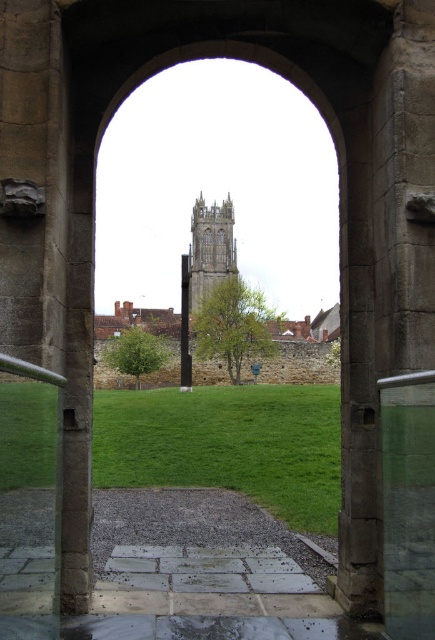
Question: Does green grass at center appear on the left side of stone tower at center?

Choices:
 (A) yes
 (B) no

Answer: (A)

Question: Which point is farther from the camera taking this photo?

Choices:
 (A) (210, 262)
 (B) (110, 374)
 (C) (140, 410)

Answer: (A)

Question: Does green grass at center appear on the right side of stone gothic tower at center?

Choices:
 (A) yes
 (B) no

Answer: (A)

Question: Does stone tower at center have a greater width compared to black stone pillar at center?

Choices:
 (A) no
 (B) yes

Answer: (B)

Question: Which object is farther from the camera taking this photo?

Choices:
 (A) stone tower at center
 (B) black stone pillar at center
 (C) stone gothic tower at center

Answer: (C)

Question: Which of the following is the farthest from the observer?

Choices:
 (A) stone tower at center
 (B) green grass at center
 (C) black stone pillar at center
 (D) stone gothic tower at center

Answer: (D)